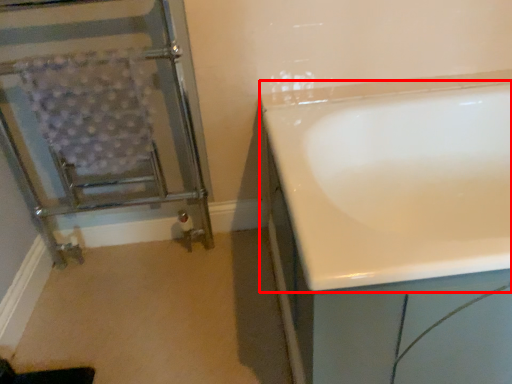
Question: From the image's perspective, where is bathtub (annotated by the red box) located in relation to screen door in the image?

Choices:
 (A) below
 (B) above

Answer: (A)